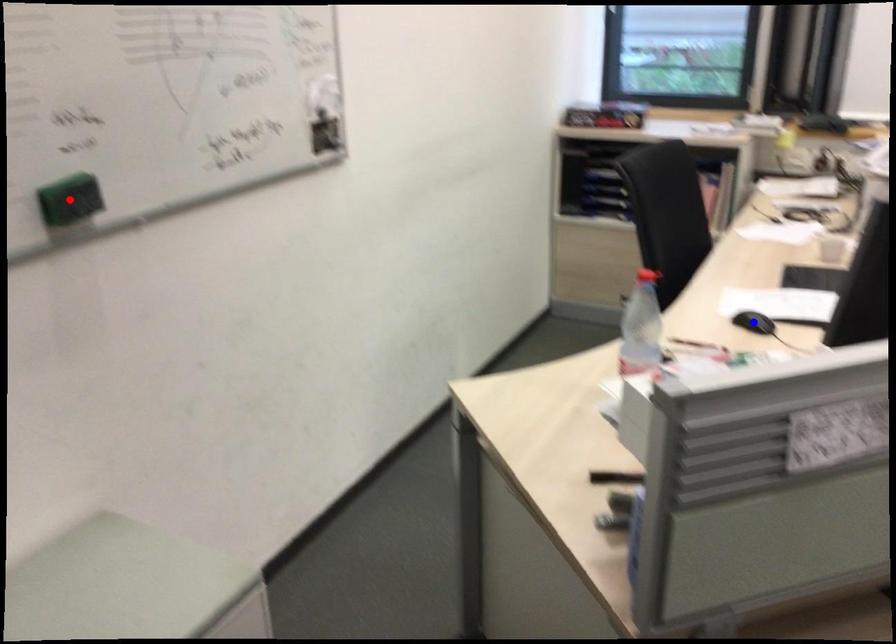
Question: In the image, two points are highlighted. Which point is nearer to the camera? Reply with the corresponding letter.

Choices:
 (A) blue point
 (B) red point

Answer: (B)